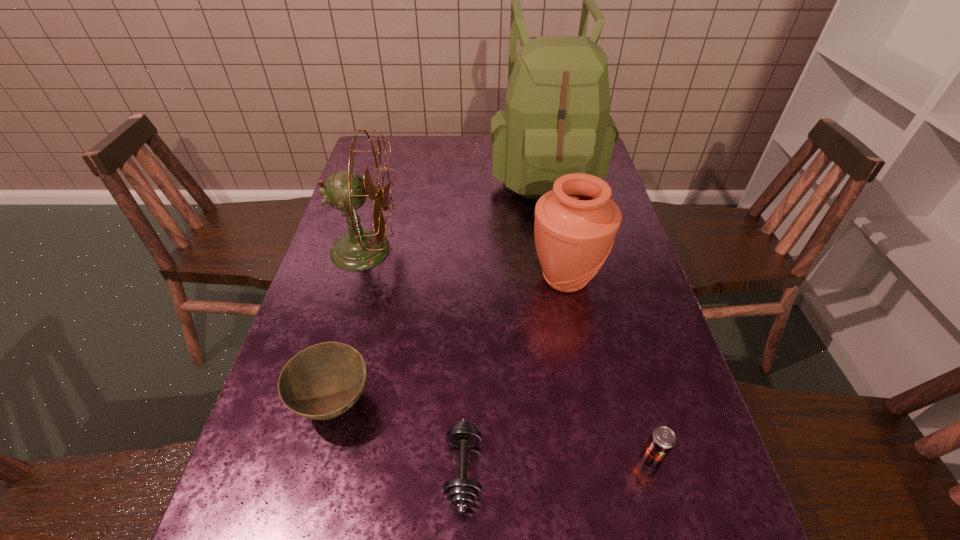
This screenshot has width=960, height=540. In order to click on object that is the closest to the farthest object in this screenshot , I will do `click(575, 225)`.

At what (x,y) coordinates should I click in order to perform the action: click on the second closest object to the fan. Please return your answer as a coordinate pair (x, y). Looking at the image, I should click on pyautogui.click(x=556, y=121).

Where is `vacant position in the image that satisfies the following two spatial constraints: 1. in front of the beer can, directing air flow; 2. on the right side of the second tallest object`? This screenshot has height=540, width=960. vacant position in the image that satisfies the following two spatial constraints: 1. in front of the beer can, directing air flow; 2. on the right side of the second tallest object is located at coordinates (305, 459).

Find the location of `vacant space that satisfies the following two spatial constraints: 1. on the front pocket of the farthest object; 2. in front of the fan, directing air flow`. vacant space that satisfies the following two spatial constraints: 1. on the front pocket of the farthest object; 2. in front of the fan, directing air flow is located at coordinates (559, 250).

The width and height of the screenshot is (960, 540). Identify the location of blank space that satisfies the following two spatial constraints: 1. on the back side of the shortest object; 2. in front of the second tallest object, directing air flow. (469, 250).

This screenshot has width=960, height=540. Identify the location of free space that satisfies the following two spatial constraints: 1. on the front side of the dumbbell; 2. on the right side of the bowl. (317, 470).

This screenshot has width=960, height=540. I want to click on free location that satisfies the following two spatial constraints: 1. on the front pocket of the beer can; 2. on the left side of the farthest object, so [x=598, y=459].